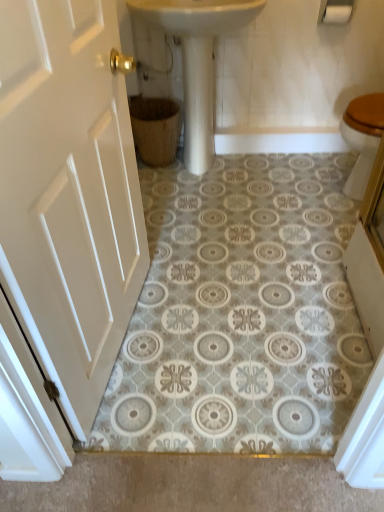
Image resolution: width=384 pixels, height=512 pixels. What do you see at coordinates (156, 129) in the screenshot?
I see `woven brown basket at lower center` at bounding box center [156, 129].

Identify the location of white glossy sink at center. pyautogui.click(x=197, y=59).

Image resolution: width=384 pixels, height=512 pixels. Describe the element at coordinates (337, 14) in the screenshot. I see `white matte toilet paper at upper right` at that location.

In order to click on woven brown basket at lower center in this screenshot , I will do `click(156, 129)`.

Can you see white matte toilet paper at upper right touching white glossy sink at center?

They are not placed beside each other.

Does point (346, 17) come in front of point (188, 120)?

Yes, it is.

From a real-world perspective, does white matte toilet paper at upper right sit lower than white glossy sink at center?

No, from a real-world perspective, white matte toilet paper at upper right is not beneath white glossy sink at center.

Would you say white matte toilet paper at upper right is to the left or to the right of white glossy sink at center in the picture?

From the image, it's evident that white matte toilet paper at upper right is to the right of white glossy sink at center.

Is woven brown basket at lower center spatially inside white matte toilet paper at upper right, or outside of it?

woven brown basket at lower center cannot be found inside white matte toilet paper at upper right.

Is woven brown basket at lower center to the right of white matte toilet paper at upper right from the viewer's perspective?

No.

Is woven brown basket at lower center far from white matte toilet paper at upper right?

No, woven brown basket at lower center is not far away from white matte toilet paper at upper right.

Can you confirm if woven brown basket at lower center is thinner than white matte toilet paper at upper right?

Incorrect, the width of woven brown basket at lower center is not less than that of white matte toilet paper at upper right.

In the scene shown: Between white glossy sink at center and white painted wood door at left, which one has more height?

white painted wood door at left is taller.

Locate an element on the screen. Image resolution: width=384 pixels, height=512 pixels. door above the white glossy sink at center (from a real-world perspective) is located at coordinates (69, 192).

Is white painted wood door at left surrounded by white glossy sink at center?

No, white painted wood door at left is not inside white glossy sink at center.

Which is more to the left, white glossy sink at center or white painted wood door at left?

From the viewer's perspective, white painted wood door at left appears more on the left side.

Is white glossy sink at center far away from woven brown basket at lower center?

No.

Between white glossy sink at center and woven brown basket at lower center, which one has larger size?

white glossy sink at center is bigger.

Is white glossy sink at center aimed at woven brown basket at lower center?

No, white glossy sink at center is not facing towards woven brown basket at lower center.

Looking at this image, from a real-world perspective, is white glossy sink at center physically located above or below woven brown basket at lower center?

Clearly, from a real-world perspective, white glossy sink at center is above woven brown basket at lower center.

Which of these two, white glossy sink at center or white matte toilet paper at upper right, stands taller?

Standing taller between the two is white glossy sink at center.

Considering the sizes of white glossy sink at center and white matte toilet paper at upper right in the image, is white glossy sink at center wider or thinner than white matte toilet paper at upper right?

In the image, white glossy sink at center appears to be wider than white matte toilet paper at upper right.

Does white glossy sink at center contain white matte toilet paper at upper right?

Actually, white matte toilet paper at upper right is outside white glossy sink at center.

I want to click on toilet paper above the white glossy sink at center (from the image's perspective), so click(337, 14).

Considering the relative sizes of woven brown basket at lower center and white painted wood door at left in the image provided, is woven brown basket at lower center smaller than white painted wood door at left?

Indeed, woven brown basket at lower center has a smaller size compared to white painted wood door at left.

Is white painted wood door at left at the back of woven brown basket at lower center?

woven brown basket at lower center is not turned away from white painted wood door at left.

Is woven brown basket at lower center at the left side of white painted wood door at left?

No, woven brown basket at lower center is not to the left of white painted wood door at left.

Looking at the image, does white painted wood door at left seem bigger or smaller compared to white glossy sink at center?

white painted wood door at left is smaller than white glossy sink at center.

Is white painted wood door at left oriented away from white glossy sink at center?

No, white painted wood door at left's orientation is not away from white glossy sink at center.

Is white painted wood door at left not near white glossy sink at center?

white painted wood door at left is actually quite close to white glossy sink at center.

From the image's perspective, who appears lower, white painted wood door at left or white glossy sink at center?

white painted wood door at left, from the image's perspective.

Find the location of a particular element. toilet paper that is on the right side of white glossy sink at center is located at coordinates (337, 14).

The width and height of the screenshot is (384, 512). I want to click on basket below the white matte toilet paper at upper right (from the image's perspective), so click(156, 129).

Estimate the real-world distances between objects in this image. Which object is further from white glossy sink at center, white painted wood door at left or white matte toilet paper at upper right?

white painted wood door at left is further to white glossy sink at center.

Looking at the image, which one is located further to woven brown basket at lower center, white painted wood door at left or white glossy sink at center?

Among the two, white painted wood door at left is located further to woven brown basket at lower center.

Based on their spatial positions, is white matte toilet paper at upper right or woven brown basket at lower center closer to white painted wood door at left?

woven brown basket at lower center lies closer to white painted wood door at left than the other object.

Estimate the real-world distances between objects in this image. Which object is further from white painted wood door at left, white matte toilet paper at upper right or white glossy sink at center?

white matte toilet paper at upper right lies further to white painted wood door at left than the other object.

Considering their positions, is woven brown basket at lower center positioned further to white painted wood door at left than white matte toilet paper at upper right?

white matte toilet paper at upper right lies further to white painted wood door at left than the other object.

Consider the image. Considering their positions, is woven brown basket at lower center positioned further to white glossy sink at center than white matte toilet paper at upper right?

white matte toilet paper at upper right is further to white glossy sink at center.

Looking at the image, which one is located closer to white painted wood door at left, white glossy sink at center or woven brown basket at lower center?

white glossy sink at center is positioned closer to the anchor white painted wood door at left.

Looking at the image, which one is located closer to white glossy sink at center, white matte toilet paper at upper right or woven brown basket at lower center?

woven brown basket at lower center is positioned closer to the anchor white glossy sink at center.

I want to click on sink positioned between white painted wood door at left and white matte toilet paper at upper right from near to far, so click(197, 59).

I want to click on sink between woven brown basket at lower center and white matte toilet paper at upper right in the horizontal direction, so click(197, 59).

You are a GUI agent. You are given a task and a screenshot of the screen. Output one action in this format:
    pyautogui.click(x=<x>, y=<y>)
    Task: Click on the sink positioned between white painted wood door at left and woven brown basket at lower center from near to far
    
    Given the screenshot: What is the action you would take?
    pyautogui.click(x=197, y=59)

At what (x,y) coordinates should I click in order to perform the action: click on toilet paper between white painted wood door at left and woven brown basket at lower center in the front-back direction. Please return your answer as a coordinate pair (x, y). This screenshot has width=384, height=512. Looking at the image, I should click on (337, 14).